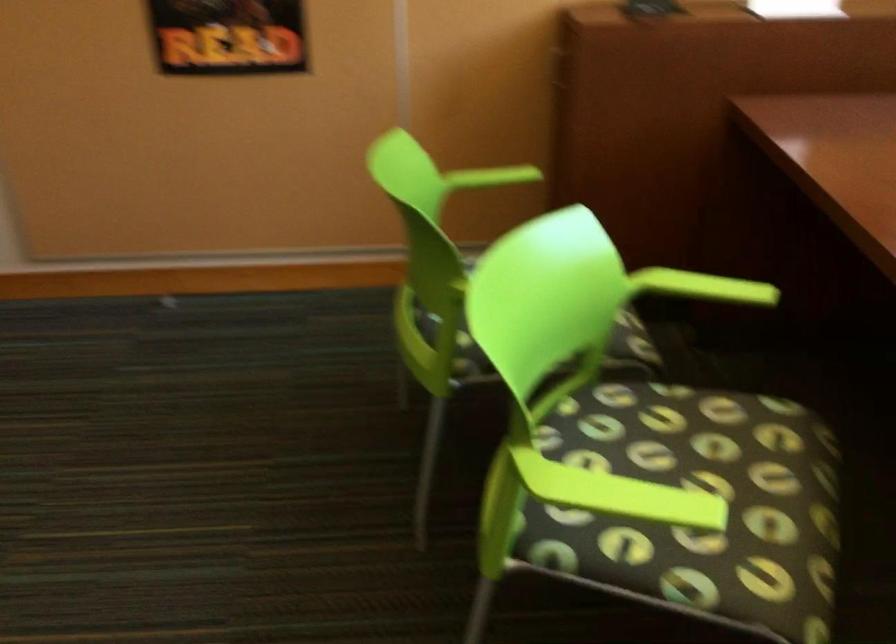
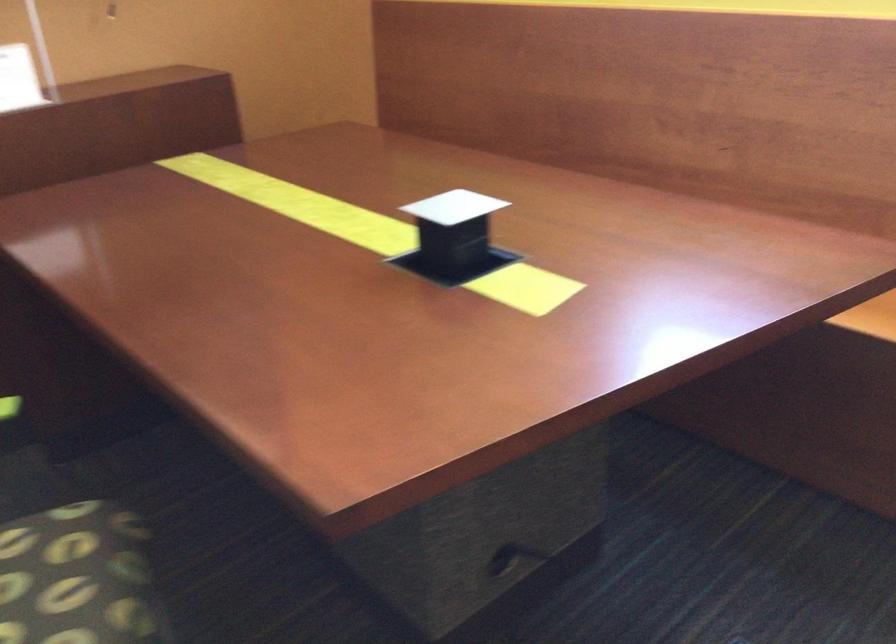
The point at (760, 476) is marked in the first image. Where is the corresponding point in the second image?

(74, 576)